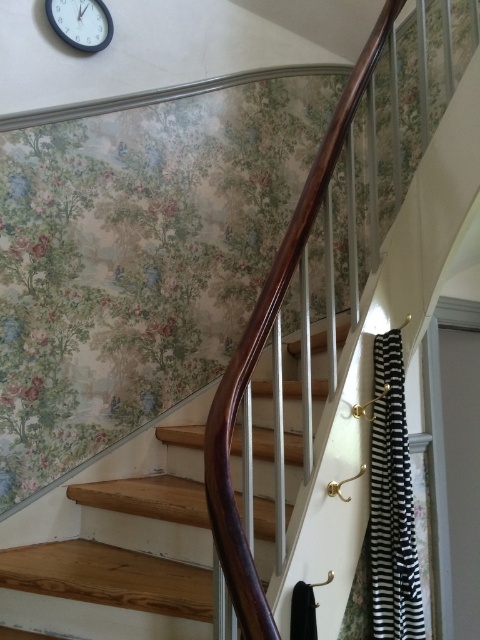
Who is more forward, (202, 513) or (75, 19)?

Point (202, 513) is in front.

Which is more to the right, wooden stairs at center or blue glossy clock at upper left?

Positioned to the right is wooden stairs at center.

Is point (55, 580) farther from camera compared to point (87, 19)?

No, it is not.

The height and width of the screenshot is (640, 480). In order to click on wooden stairs at center in this screenshot , I will do `click(108, 577)`.